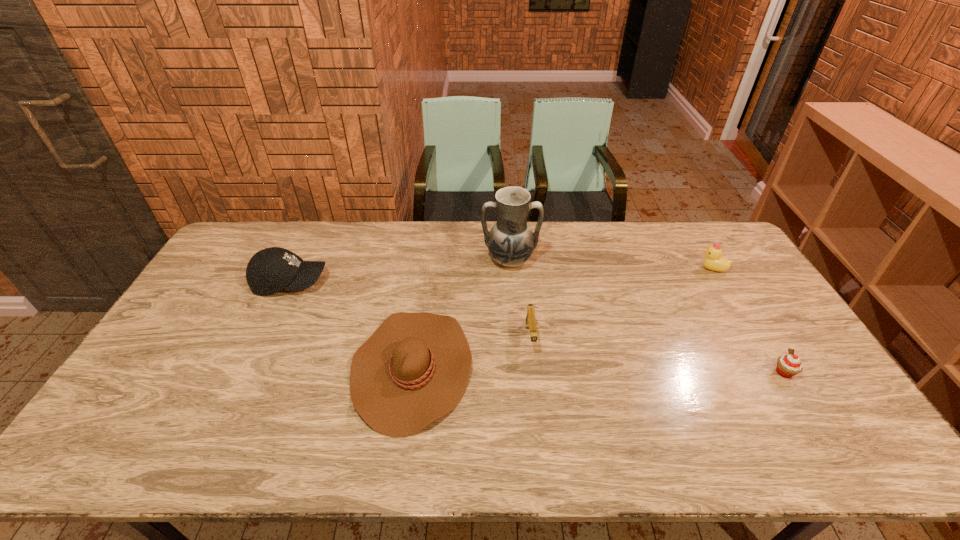
The image size is (960, 540). I want to click on vacant area at the far edge of the desktop, so click(292, 241).

Image resolution: width=960 pixels, height=540 pixels. Find the location of `blank space at the near edge of the desktop`. blank space at the near edge of the desktop is located at coordinates (442, 464).

The image size is (960, 540). I want to click on vacant space at the left edge of the desktop, so click(x=180, y=325).

You are a GUI agent. You are given a task and a screenshot of the screen. Output one action in this format:
    pyautogui.click(x=<x>, y=<y>)
    Task: Click on the vacant space at the right edge of the desktop
    The image size is (960, 540).
    Given the screenshot: What is the action you would take?
    pyautogui.click(x=741, y=286)

In the image, there is a desktop. Find the location of `vacant space at the near left corner`. vacant space at the near left corner is located at coordinates (146, 465).

At what (x,y) coordinates should I click in order to perform the action: click on unoccupied area between the pistol and the third tallest object. Please return your answer as a coordinate pair (x, y). Looking at the image, I should click on (621, 303).

This screenshot has height=540, width=960. I want to click on unoccupied position between the cowboy hat and the duckling, so click(x=563, y=318).

Where is `empty space that is in between the third tallest object and the pitcher`? The width and height of the screenshot is (960, 540). empty space that is in between the third tallest object and the pitcher is located at coordinates coord(611,265).

Find the location of `free area in between the pistol and the tallest object`. free area in between the pistol and the tallest object is located at coordinates (520, 299).

Where is `vacant space that's between the duckling and the tallest object`? This screenshot has height=540, width=960. vacant space that's between the duckling and the tallest object is located at coordinates (611, 265).